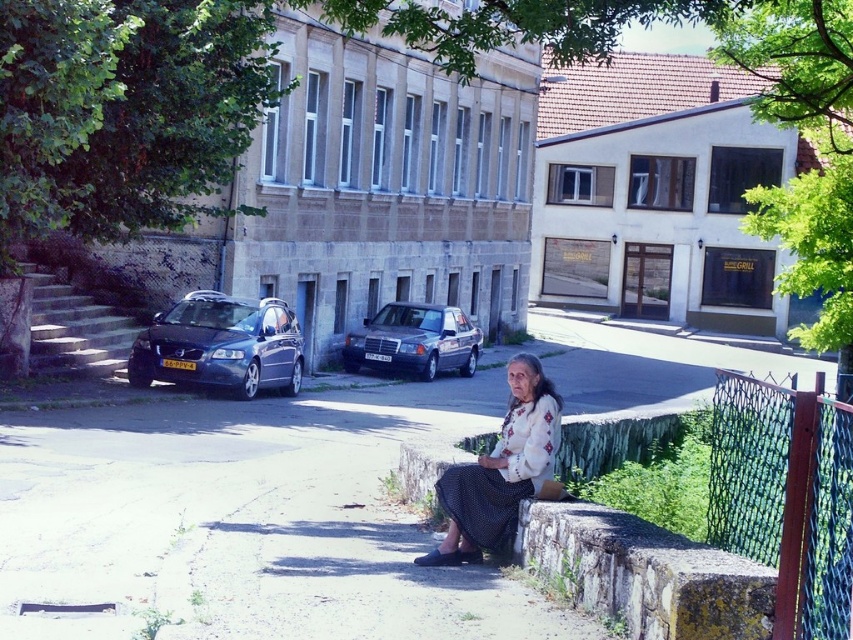
Which is more to the left, green mesh fence at right or shiny metallic car at left?

shiny metallic car at left

How much distance is there between green mesh fence at right and shiny metallic car at left?

green mesh fence at right and shiny metallic car at left are 12.83 meters apart.

Is point (728, 500) behind point (293, 362)?

That is False.

The image size is (853, 640). What are the coordinates of `green mesh fence at right` in the screenshot? It's located at (785, 497).

Does shiny metallic car at left have a larger size compared to metallic silver sedan at center?

Actually, shiny metallic car at left might be smaller than metallic silver sedan at center.

Between point (206, 372) and point (341, 353), which one is positioned in front?

Point (206, 372)

Which is in front, point (218, 312) or point (434, 356)?

Positioned in front is point (218, 312).

Where is `shiny metallic car at left`? shiny metallic car at left is located at coordinates (219, 346).

Is white embroidered blouse at center to the right of metallic silver sedan at center from the viewer's perspective?

Yes, white embroidered blouse at center is to the right of metallic silver sedan at center.

Is white embroidered blouse at center taller than metallic silver sedan at center?

In fact, white embroidered blouse at center may be shorter than metallic silver sedan at center.

The image size is (853, 640). Find the location of `white embroidered blouse at center`. white embroidered blouse at center is located at coordinates (500, 470).

The image size is (853, 640). What are the coordinates of `white embroidered blouse at center` in the screenshot? It's located at (500, 470).